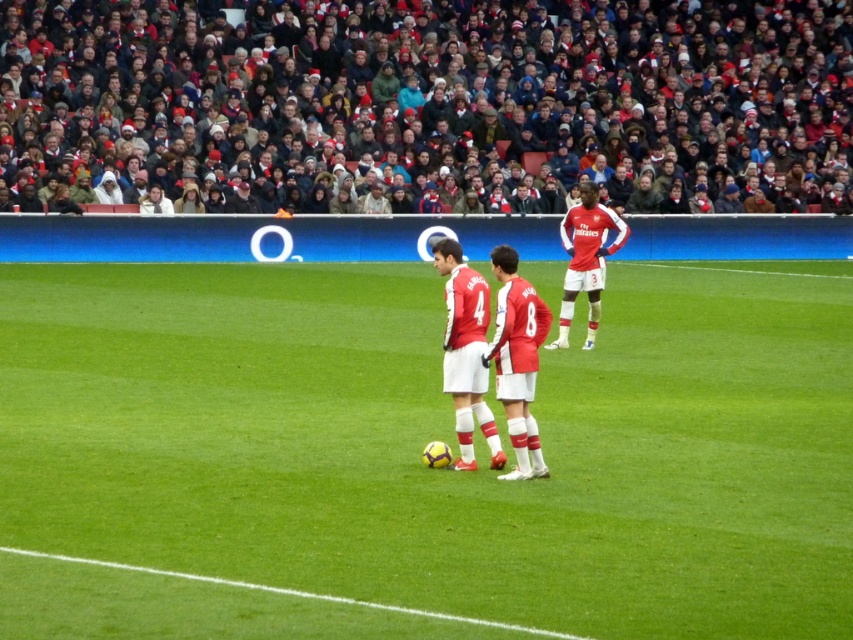
Can you confirm if matte red jersey at center is positioned to the left of green grass at lower center?

No, matte red jersey at center is not to the left of green grass at lower center.

Who is positioned more to the left, matte red jersey at center or green grass at lower center?

Positioned to the left is green grass at lower center.

Which is behind, point (459, 259) or point (140, 566)?

Point (459, 259)

Identify the location of matte red jersey at center. Image resolution: width=853 pixels, height=640 pixels. (466, 348).

Does red scarf at upper center lie in front of matte red jersey at center?

No, red scarf at upper center is behind matte red jersey at center.

The height and width of the screenshot is (640, 853). What do you see at coordinates (431, 93) in the screenshot? I see `red scarf at upper center` at bounding box center [431, 93].

Identify the location of red scarf at upper center. Image resolution: width=853 pixels, height=640 pixels. (431, 93).

Is point (741, 316) positioned after point (393, 211)?

That is False.

Between smooth green grass at center and red scarf at upper center, which one has more height?

red scarf at upper center

Measure the distance between smooth green grass at center and camera.

A distance of 24.35 feet exists between smooth green grass at center and camera.

You are a GUI agent. You are given a task and a screenshot of the screen. Output one action in this format:
    pyautogui.click(x=<x>, y=<y>)
    Task: Click on the smooth green grass at center
    The image size is (853, 640).
    Given the screenshot: What is the action you would take?
    pyautogui.click(x=442, y=440)